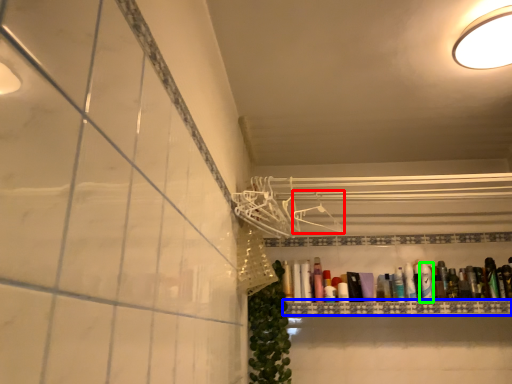
Question: Which object is positioned farthest from hanger (highlighted by a red box)? Select from ledge (highlighted by a blue box) and toiletry (highlighted by a green box).

Choices:
 (A) ledge
 (B) toiletry

Answer: (B)